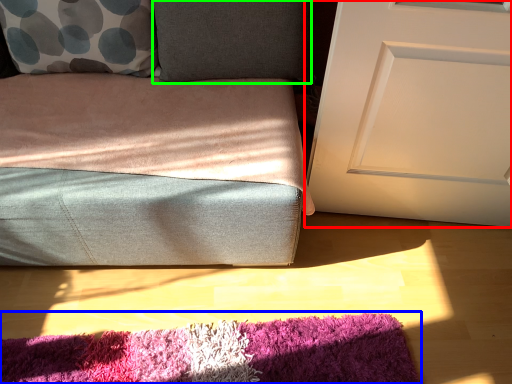
Question: Based on their relative distances, which object is nearer to door (highlighted by a red box)? Choose from mat (highlighted by a blue box) and pillow (highlighted by a green box).

Choices:
 (A) mat
 (B) pillow

Answer: (B)